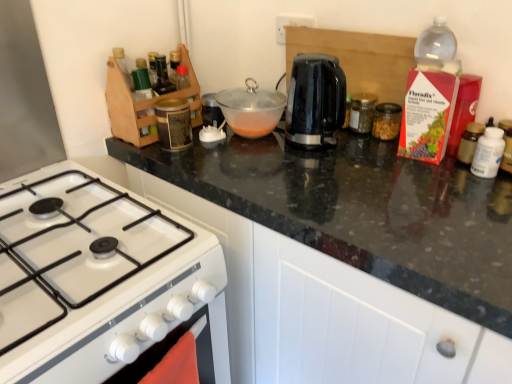
Question: Could you tell me if white glossy gas stove at lower left is turned towards black glossy electric kettle at center, which ranks as the 2th kitchen appliance in left-to-right order?

Choices:
 (A) no
 (B) yes

Answer: (A)

Question: Is white glossy gas stove at lower left thinner than black glossy electric kettle at center, the fourth kitchen appliance viewed from the right?

Choices:
 (A) no
 (B) yes

Answer: (A)

Question: Does white glossy gas stove at lower left appear on the right side of black glossy electric kettle at center, the fourth kitchen appliance viewed from the right?

Choices:
 (A) no
 (B) yes

Answer: (A)

Question: Is black glossy electric kettle at center, the fourth kitchen appliance viewed from the right, inside white glossy gas stove at lower left?

Choices:
 (A) yes
 (B) no

Answer: (B)

Question: Can you confirm if white glossy gas stove at lower left is smaller than black glossy electric kettle at center, the fourth kitchen appliance viewed from the right?

Choices:
 (A) yes
 (B) no

Answer: (B)

Question: Visually, is transparent glass bowl at center, arranged as the 5th kitchen appliance when viewed from the right, positioned to the left or to the right of black granite countertop at upper center?

Choices:
 (A) right
 (B) left

Answer: (B)

Question: Is transparent glass bowl at center, positioned as the 1th kitchen appliance in left-to-right order, bigger or smaller than black granite countertop at upper center?

Choices:
 (A) small
 (B) big

Answer: (A)

Question: In the image, is transparent glass bowl at center, positioned as the 1th kitchen appliance in left-to-right order, positioned in front of or behind black granite countertop at upper center?

Choices:
 (A) front
 (B) behind

Answer: (B)

Question: Considering the positions of transparent glass bowl at center, positioned as the 1th kitchen appliance in left-to-right order, and black granite countertop at upper center in the image, is transparent glass bowl at center, positioned as the 1th kitchen appliance in left-to-right order, taller or shorter than black granite countertop at upper center?

Choices:
 (A) short
 (B) tall

Answer: (A)

Question: Is clear glass jar at center-right, placed as the second kitchen appliance when sorted from right to left, taller or shorter than black granite countertop at upper center?

Choices:
 (A) short
 (B) tall

Answer: (A)

Question: Is point (379, 104) positioned closer to the camera than point (295, 206)?

Choices:
 (A) closer
 (B) farther

Answer: (B)

Question: In terms of width, does clear glass jar at center-right, the fourth kitchen appliance viewed from the left, look wider or thinner when compared to black granite countertop at upper center?

Choices:
 (A) wide
 (B) thin

Answer: (B)

Question: In terms of size, does clear glass jar at center-right, the fourth kitchen appliance viewed from the left, appear bigger or smaller than black granite countertop at upper center?

Choices:
 (A) small
 (B) big

Answer: (A)

Question: Looking at the image, does black granite countertop at upper center seem bigger or smaller compared to transparent glass bowl at center, positioned as the 1th kitchen appliance in left-to-right order?

Choices:
 (A) small
 (B) big

Answer: (B)

Question: Based on their positions, is black granite countertop at upper center located to the left or right of transparent glass bowl at center, arranged as the 5th kitchen appliance when viewed from the right?

Choices:
 (A) right
 (B) left

Answer: (A)